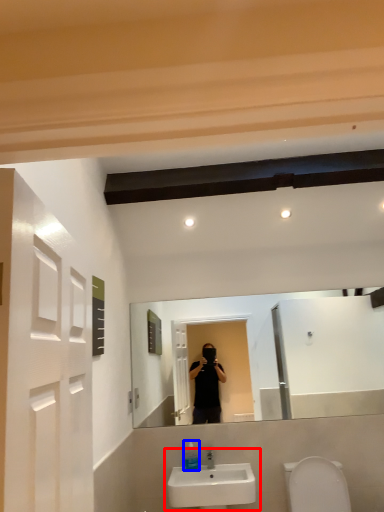
Question: Among these objects, which one is farthest to the camera, sink (highlighted by a red box) or soap dispenser (highlighted by a blue box)?

Choices:
 (A) sink
 (B) soap dispenser

Answer: (B)